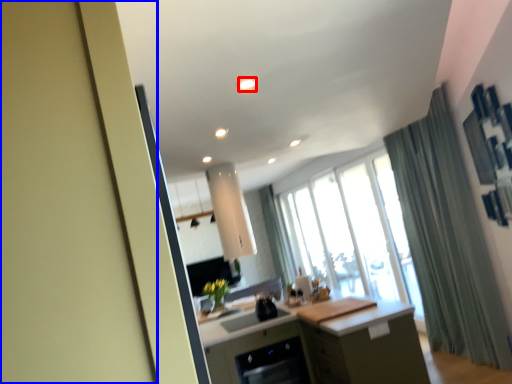
Question: Which point is closer to the camera, light (highlighted by a red box) or screen door (highlighted by a blue box)?

Choices:
 (A) light
 (B) screen door

Answer: (B)